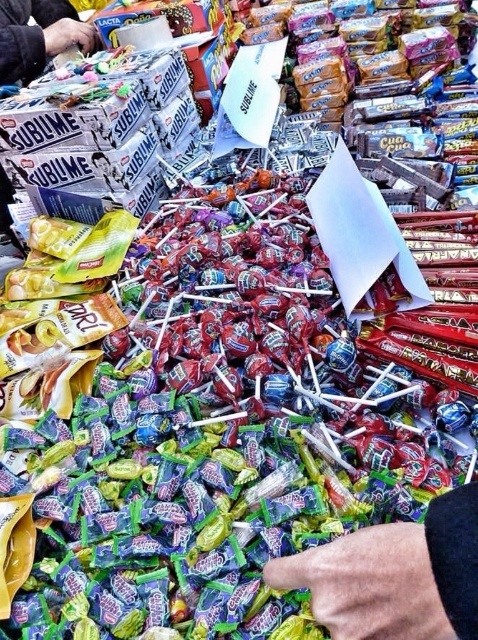
Question: Which point is closer to the camera?

Choices:
 (A) (49, 48)
 (B) (467, 600)

Answer: (B)

Question: Does smooth skin hand at center appear under smooth plastic hand at upper left?

Choices:
 (A) no
 (B) yes

Answer: (B)

Question: Which point is farther to the camera?

Choices:
 (A) (74, 19)
 (B) (464, 600)

Answer: (A)

Question: Can you confirm if smooth skin hand at center is positioned to the left of smooth plastic hand at upper left?

Choices:
 (A) yes
 (B) no

Answer: (B)

Question: From the image, what is the correct spatial relationship of smooth skin hand at center in relation to smooth plastic hand at upper left?

Choices:
 (A) below
 (B) above

Answer: (A)

Question: Which object appears closest to the camera in this image?

Choices:
 (A) smooth plastic hand at upper left
 (B) smooth skin hand at center

Answer: (B)